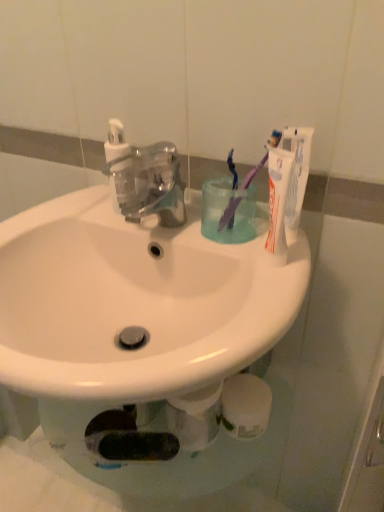
Where is `vacant space that is to the left of purple plastic toothbrush at upper right, the 1th toothbrush when ordered from left to right`? vacant space that is to the left of purple plastic toothbrush at upper right, the 1th toothbrush when ordered from left to right is located at coordinates (166, 221).